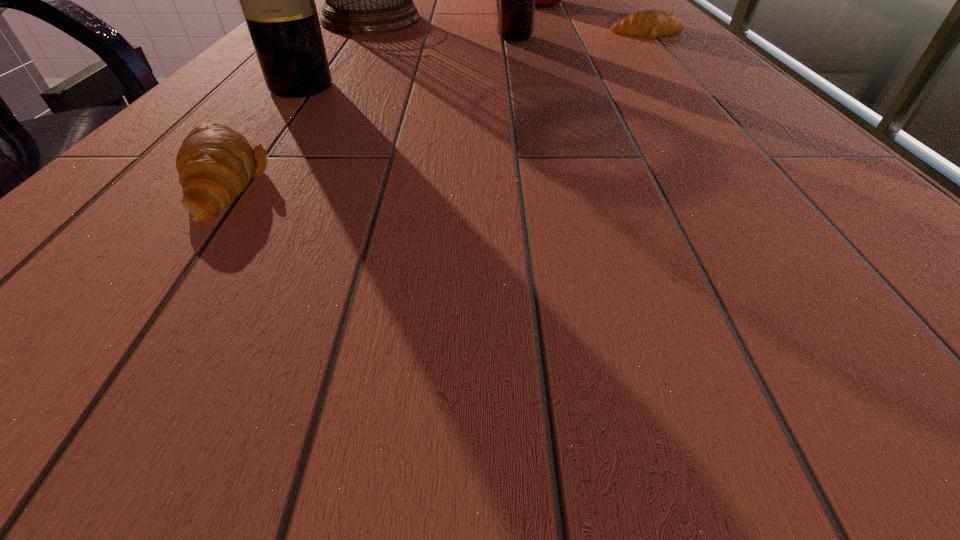
This screenshot has height=540, width=960. I want to click on vacant space located on the front-facing side of the liquor, so click(258, 144).

Image resolution: width=960 pixels, height=540 pixels. I want to click on free region located on the label of the third shortest object, so click(x=521, y=69).

Image resolution: width=960 pixels, height=540 pixels. Identify the location of object that is at the near edge. (215, 163).

You are a GUI agent. You are given a task and a screenshot of the screen. Output one action in this format:
    pyautogui.click(x=<x>, y=<y>)
    Task: Click on the crescent roll situated at the left edge
    This screenshot has width=960, height=540.
    Given the screenshot: What is the action you would take?
    pyautogui.click(x=215, y=163)

Where is `birdcage located in the left edge section of the desktop`? This screenshot has width=960, height=540. birdcage located in the left edge section of the desktop is located at coordinates (358, 0).

In order to click on liquor that is at the left edge in this screenshot , I will do `click(278, 0)`.

This screenshot has width=960, height=540. Identify the location of object at the right edge. (650, 23).

This screenshot has height=540, width=960. I want to click on object situated at the near left corner, so click(215, 163).

This screenshot has height=540, width=960. In the image, there is a desktop. What are the coordinates of `vacant space at the near edge` in the screenshot? It's located at (468, 269).

In order to click on vacant space at the left edge of the desktop in this screenshot , I will do `click(265, 94)`.